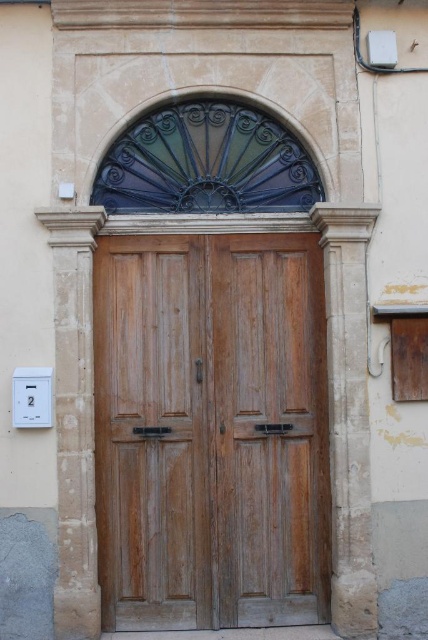
Question: Which point is farther from the camera taking this photo?

Choices:
 (A) (36, 387)
 (B) (300, 387)

Answer: (B)

Question: Is wooden door at center positioned in front of white plastic electric outlet at lower left?

Choices:
 (A) yes
 (B) no

Answer: (B)

Question: Can you confirm if wooden door at center is positioned below white plastic electric outlet at lower left?

Choices:
 (A) no
 (B) yes

Answer: (B)

Question: Is wooden door at center positioned in front of white plastic electric outlet at lower left?

Choices:
 (A) yes
 (B) no

Answer: (B)